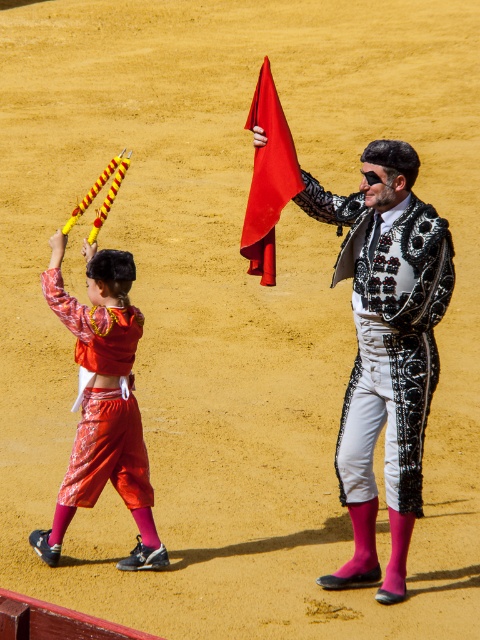
Measure the distance between shiny red pants at left and camera.

They are 23.01 feet apart.

Between shiny red pants at left and red satin flag at center, which one appears on the right side from the viewer's perspective?

From the viewer's perspective, red satin flag at center appears more on the right side.

Is point (109, 404) positioned before point (283, 150)?

No, it is not.

This screenshot has width=480, height=640. Identify the location of shiny red pants at left. (103, 401).

Which is above, shiny silver vest at center or shiny red pants at left?

shiny silver vest at center is above.

Does shiny silver vest at center appear over shiny red pants at left?

Indeed, shiny silver vest at center is positioned over shiny red pants at left.

What do you see at coordinates (385, 348) in the screenshot? This screenshot has height=640, width=480. I see `shiny silver vest at center` at bounding box center [385, 348].

Find the location of a particular element. shiny silver vest at center is located at coordinates tap(385, 348).

Does shiny silver vest at center appear on the left side of red satin flag at center?

Incorrect, shiny silver vest at center is not on the left side of red satin flag at center.

Is shiny silver vest at center taller than red satin flag at center?

Yes.

Find the location of a particular element. This screenshot has width=480, height=640. shiny silver vest at center is located at coordinates (385, 348).